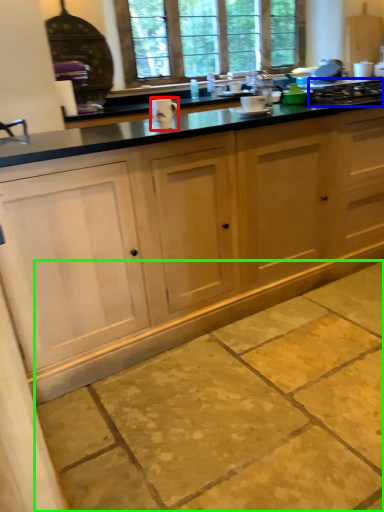
Question: Based on their relative distances, which object is nearer to appliance (highlighted by a red box)? Choose from gas stove (highlighted by a blue box) and concrete (highlighted by a green box).

Choices:
 (A) gas stove
 (B) concrete

Answer: (B)